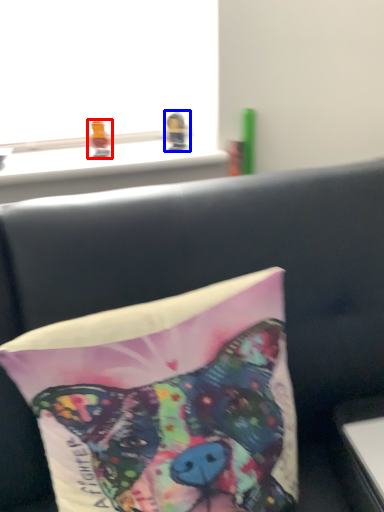
Question: Which object appears closest to the camera in this image, toy (highlighted by a red box) or toy (highlighted by a blue box)?

Choices:
 (A) toy
 (B) toy

Answer: (A)